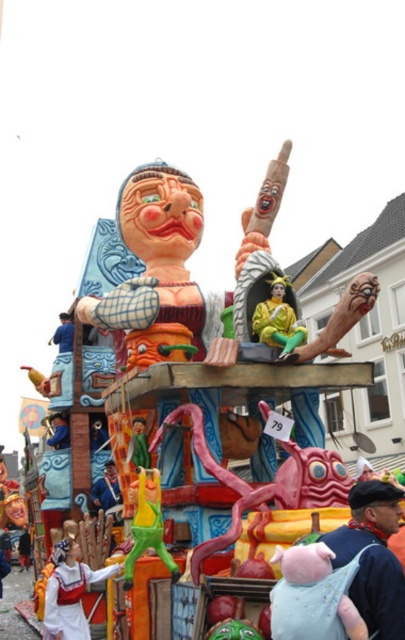
What do you see at coordinates (373, 556) in the screenshot? The width and height of the screenshot is (405, 640). I see `light blue fabric at lower right` at bounding box center [373, 556].

Which is below, light blue fabric at lower right or matte blue helmet at upper left?

light blue fabric at lower right is lower down.

Locate an element on the screen. Image resolution: width=405 pixels, height=640 pixels. light blue fabric at lower right is located at coordinates (373, 556).

Find the location of a particular element. light blue fabric pig at center is located at coordinates (x=313, y=595).

Which of these two, light blue fabric pig at center or matte blue helmet at upper left, stands taller?

matte blue helmet at upper left is taller.

What do you see at coordinates (313, 595) in the screenshot? The height and width of the screenshot is (640, 405). I see `light blue fabric pig at center` at bounding box center [313, 595].

Image resolution: width=405 pixels, height=640 pixels. I want to click on light blue fabric pig at center, so click(313, 595).

Can you confirm if light blue fabric at lower right is positioned to the left of shiny gold costume at center?

No, light blue fabric at lower right is not to the left of shiny gold costume at center.

Between point (383, 486) and point (277, 324), which one is positioned in front?

Point (383, 486)

Image resolution: width=405 pixels, height=640 pixels. What do you see at coordinates (373, 556) in the screenshot? I see `light blue fabric at lower right` at bounding box center [373, 556].

This screenshot has width=405, height=640. I want to click on light blue fabric at lower right, so click(373, 556).